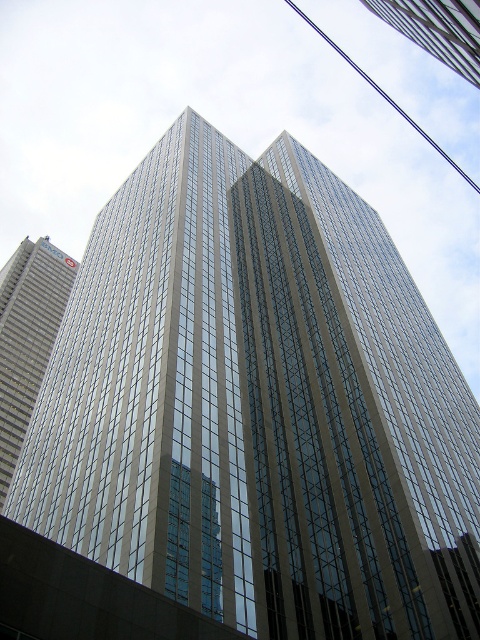
Question: Estimate the real-world distances between objects in this image. Which object is closer to the silver metallic skyscraper at left?

Choices:
 (A) blue wire at upper center
 (B) transparent glass skyscraper at upper center

Answer: (B)

Question: Which of the following is the closest to the observer?

Choices:
 (A) transparent glass skyscraper at upper center
 (B) silver metallic skyscraper at left
 (C) blue wire at upper center

Answer: (A)

Question: Is silver metallic skyscraper at left positioned at the back of transparent glass skyscraper at upper center?

Choices:
 (A) yes
 (B) no

Answer: (A)

Question: Which point is closer to the camera?

Choices:
 (A) silver metallic skyscraper at left
 (B) blue wire at upper center

Answer: (A)

Question: Does silver metallic skyscraper at left appear on the right side of transparent glass skyscraper at upper center?

Choices:
 (A) no
 (B) yes

Answer: (A)

Question: Does silver metallic skyscraper at left have a greater width compared to blue wire at upper center?

Choices:
 (A) yes
 (B) no

Answer: (B)